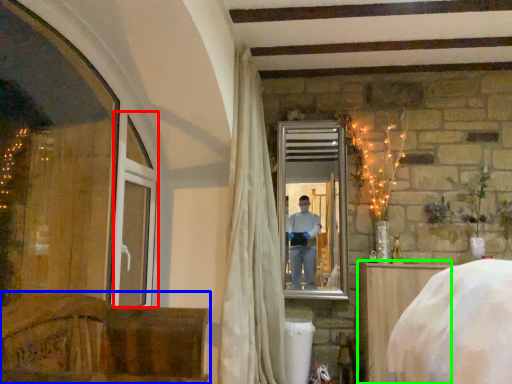
Question: Estimate the real-world distances between objects in this image. Which object is closer to window frame (highlighted by a red box), furniture (highlighted by a blue box) or furniture (highlighted by a green box)?

Choices:
 (A) furniture
 (B) furniture

Answer: (A)